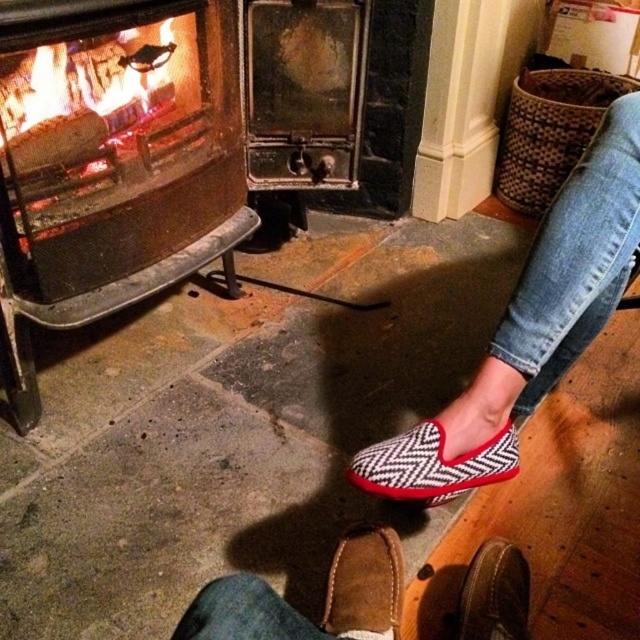
Question: Which point is farther to the camera?

Choices:
 (A) brown suede shoe at lower right
 (B) metallic glass fireplace at left

Answer: (B)

Question: Considering the relative positions of black and white zigzag slipper at lower center and brown suede shoes at lower center in the image provided, where is black and white zigzag slipper at lower center located with respect to brown suede shoes at lower center?

Choices:
 (A) below
 (B) above

Answer: (B)

Question: In this image, where is herringbone fabric slipper at lower center located relative to brown suede shoe at lower center?

Choices:
 (A) left
 (B) right

Answer: (B)

Question: Estimate the real-world distances between objects in this image. Which object is farther from the brown suede shoes at lower center?

Choices:
 (A) herringbone fabric slipper at lower center
 (B) brown suede shoe at lower center
 (C) metallic glass fireplace at left

Answer: (C)

Question: Is metallic glass fireplace at left behind brown suede shoe at lower right?

Choices:
 (A) yes
 (B) no

Answer: (A)

Question: Which object is the farthest from the herringbone fabric slipper at lower center?

Choices:
 (A) brown suede shoe at lower right
 (B) brown suede shoe at lower center

Answer: (A)